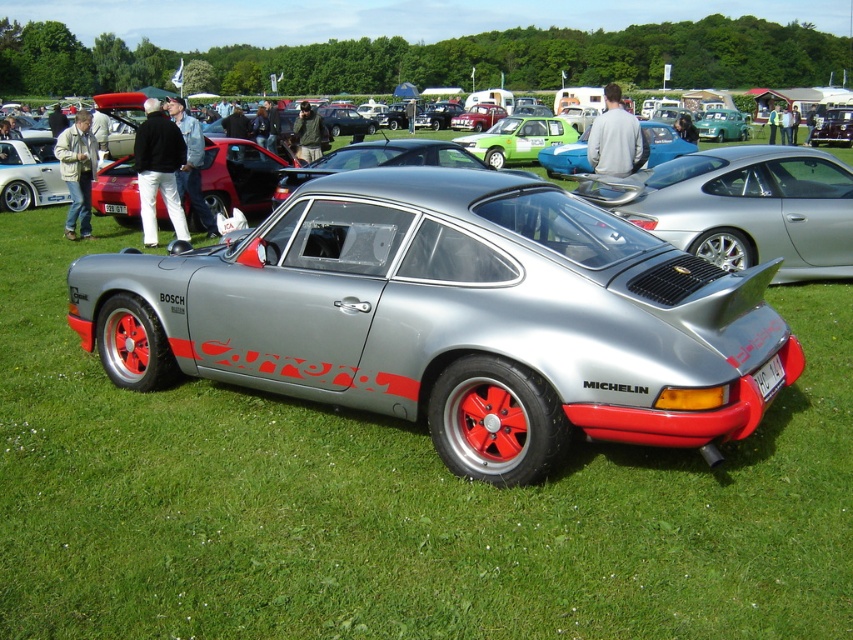
Question: From the image, what is the correct spatial relationship of satin metallic car at center in relation to silver metallic car at center?

Choices:
 (A) right
 (B) left

Answer: (B)

Question: Is silver metallic car at center above green matte hatchback at center?

Choices:
 (A) no
 (B) yes

Answer: (A)

Question: Which object is the closest to the matte blue car at center?

Choices:
 (A) silver metallic car at center
 (B) satin metallic car at center

Answer: (A)

Question: Estimate the real-world distances between objects in this image. Which object is farther from the satin metallic car at center?

Choices:
 (A) matte blue car at center
 (B) metallic silver car at center
 (C) green matte hatchback at center

Answer: (B)

Question: Which object appears closest to the camera in this image?

Choices:
 (A) silver metallic car at center
 (B) green matte hatchback at center

Answer: (A)

Question: Can you confirm if matte blue car at center is wider than metallic silver car at center?

Choices:
 (A) yes
 (B) no

Answer: (B)